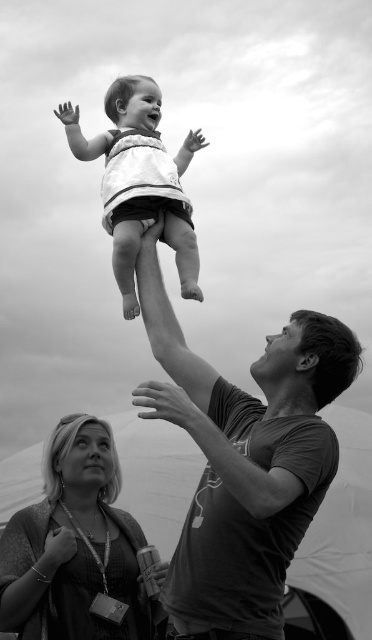
This screenshot has width=372, height=640. Describe the element at coordinates (75, 547) in the screenshot. I see `matte black dress at lower left` at that location.

Does matte black dress at lower left lie in front of white fabric baby at center?

Yes, it is.

Is point (4, 621) positioned behind point (120, 108)?

That is False.

I want to click on matte black dress at lower left, so click(75, 547).

In the scene shown: Which is more to the right, smooth dark gray shirt at upper center or white fabric baby at center?

From the viewer's perspective, smooth dark gray shirt at upper center appears more on the right side.

Is point (292, 426) more distant than point (200, 136)?

That is False.

Is point (228, 513) positioned before point (167, 195)?

Yes, point (228, 513) is closer to viewer.

In order to click on smooth dark gray shirt at upper center in this screenshot , I will do `click(245, 458)`.

Which is more to the right, smooth dark gray shirt at upper center or matte black dress at lower left?

Positioned to the right is smooth dark gray shirt at upper center.

Where is `smooth dark gray shirt at upper center`? This screenshot has width=372, height=640. smooth dark gray shirt at upper center is located at coordinates (245, 458).